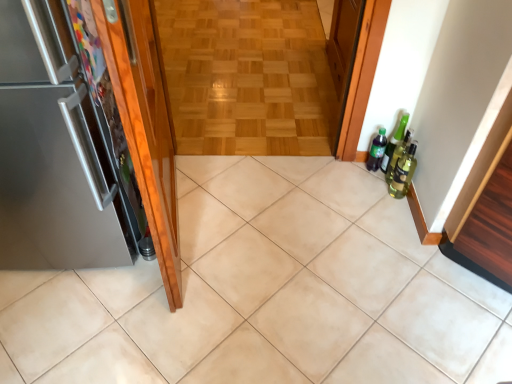
Question: From a real-world perspective, is green glass bottle at right, the 1th beer bottle viewed from the front, positioned over beige ceramic tile at center based on gravity?

Choices:
 (A) no
 (B) yes

Answer: (B)

Question: Is green glass bottle at right, which ranks as the 2th beer bottle in back-to-front order, positioned far away from beige ceramic tile at center?

Choices:
 (A) yes
 (B) no

Answer: (B)

Question: Can you confirm if green glass bottle at right, the 1th beer bottle viewed from the front, is smaller than beige ceramic tile at center?

Choices:
 (A) yes
 (B) no

Answer: (A)

Question: Is green glass bottle at right, the 1th beer bottle viewed from the front, positioned with its back to beige ceramic tile at center?

Choices:
 (A) no
 (B) yes

Answer: (A)

Question: Is beige ceramic tile at center completely or partially inside green glass bottle at right, which ranks as the 2th beer bottle in back-to-front order?

Choices:
 (A) yes
 (B) no

Answer: (B)

Question: Relative to green glass bottle at right, the 1th beer bottle viewed from the front, is satin metallic refrigerator at left, the 1th door in the left-to-right sequence, in front or behind?

Choices:
 (A) front
 (B) behind

Answer: (A)

Question: Is satin metallic refrigerator at left, the 1th door in the left-to-right sequence, inside the boundaries of green glass bottle at right, which ranks as the 2th beer bottle in back-to-front order, or outside?

Choices:
 (A) outside
 (B) inside

Answer: (A)

Question: Considering the positions of satin metallic refrigerator at left, the 1th door in the left-to-right sequence, and green glass bottle at right, which ranks as the 2th beer bottle in back-to-front order, in the image, is satin metallic refrigerator at left, the 1th door in the left-to-right sequence, taller or shorter than green glass bottle at right, which ranks as the 2th beer bottle in back-to-front order,?

Choices:
 (A) tall
 (B) short

Answer: (A)

Question: In the image, is satin metallic refrigerator at left, which is the 2th door in right-to-left order, on the left side or the right side of green glass bottle at right, the 1th beer bottle viewed from the front?

Choices:
 (A) left
 (B) right

Answer: (A)

Question: Looking at the image, does green matte bottle at right seem bigger or smaller compared to satin metallic refrigerator at left, the 1th door in the left-to-right sequence?

Choices:
 (A) small
 (B) big

Answer: (A)

Question: From their relative heights in the image, would you say green matte bottle at right is taller or shorter than satin metallic refrigerator at left, which is the 2th door in right-to-left order?

Choices:
 (A) tall
 (B) short

Answer: (B)

Question: From the image's perspective, relative to satin metallic refrigerator at left, which is the 2th door in right-to-left order, is green matte bottle at right above or below?

Choices:
 (A) below
 (B) above

Answer: (A)

Question: In terms of width, does green matte bottle at right look wider or thinner when compared to satin metallic refrigerator at left, the 1th door in the left-to-right sequence?

Choices:
 (A) thin
 (B) wide

Answer: (A)

Question: From the image's perspective, is wooden parquet floor at center above or below shiny wood door at left, the second door from the left?

Choices:
 (A) above
 (B) below

Answer: (A)

Question: Is wooden parquet floor at center in front of or behind shiny wood door at left, arranged as the first door when viewed from the right, in the image?

Choices:
 (A) front
 (B) behind

Answer: (B)